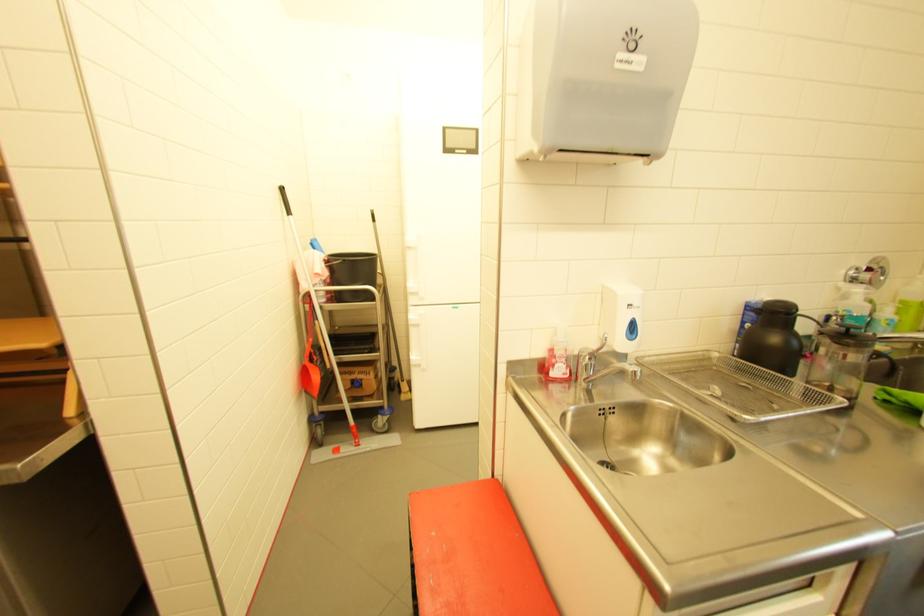
In order to click on metal faucet handle in this screenshot , I will do `click(597, 350)`.